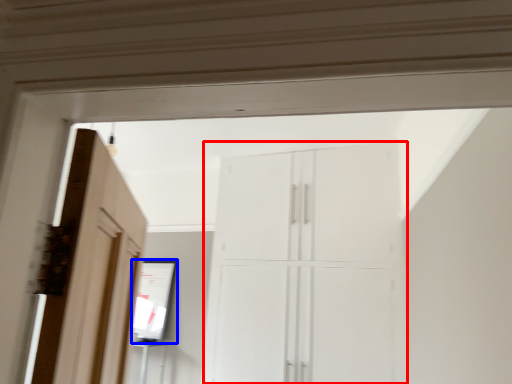
Question: Which object appears farthest to the camera in this image, cupboard (highlighted by a red box) or mirror (highlighted by a blue box)?

Choices:
 (A) cupboard
 (B) mirror

Answer: (B)